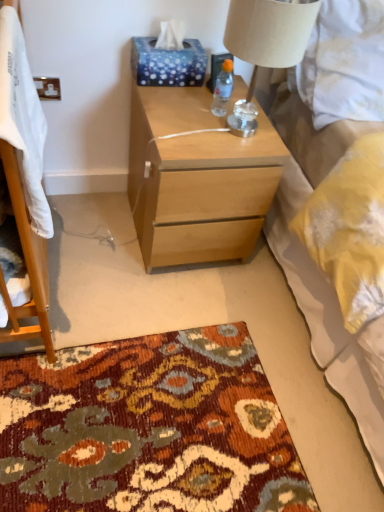
Identify the location of vacant region to the left of transparent plastic bottle at upper center. (178, 101).